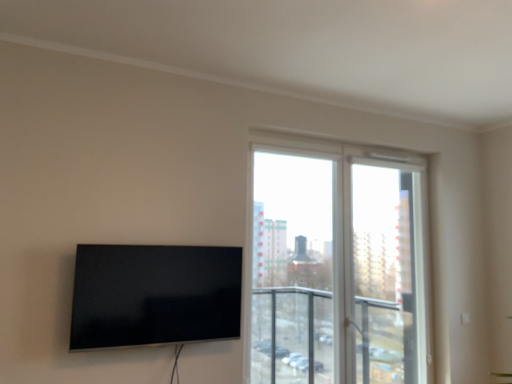
The width and height of the screenshot is (512, 384). In order to click on transparent glass window at center in this screenshot , I will do `click(336, 265)`.

Which is closer, (399, 255) or (172, 275)?

Point (399, 255) is farther from the camera than point (172, 275).

From the image's perspective, is transparent glass window at center positioned above or below matte black tv at left?

From the image's perspective, transparent glass window at center appears below matte black tv at left.

Is the depth of transparent glass window at center greater than that of matte black tv at left?

Yes, transparent glass window at center is further from the camera.

Is transparent glass window at center oriented towards matte black tv at left?

No, transparent glass window at center is not turned towards matte black tv at left.

Is transparent glass screen door at upper right wider or thinner than matte black tv at left?

Considering their sizes, transparent glass screen door at upper right looks broader than matte black tv at left.

Is transparent glass screen door at upper right to the right of matte black tv at left from the viewer's perspective?

Yes, transparent glass screen door at upper right is to the right of matte black tv at left.

How distant is transparent glass screen door at upper right from matte black tv at left?

A distance of 1.51 meters exists between transparent glass screen door at upper right and matte black tv at left.

How many degrees apart are the facing directions of transparent glass screen door at upper right and matte black tv at left?

transparent glass screen door at upper right and matte black tv at left are facing 1.27 degrees away from each other.

Where is `television above the transparent glass screen door at upper right (from the image's perspective)`? television above the transparent glass screen door at upper right (from the image's perspective) is located at coordinates (154, 295).

Is matte black tv at left positioned with its back to transparent glass screen door at upper right?

No.

Between matte black tv at left and transparent glass screen door at upper right, which one has smaller width?

With smaller width is matte black tv at left.

From a real-world perspective, which is physically above, matte black tv at left or transparent glass window at center?

From a 3D spatial view, transparent glass window at center is above.

Which of these two, matte black tv at left or transparent glass window at center, is wider?

transparent glass window at center.

Does matte black tv at left have a greater height compared to transparent glass window at center?

No.

From the image's perspective, would you say transparent glass screen door at upper right is positioned over transparent glass window at center?

No.

Considering the sizes of transparent glass screen door at upper right and transparent glass window at center in the image, is transparent glass screen door at upper right taller or shorter than transparent glass window at center?

Clearly, transparent glass screen door at upper right is shorter compared to transparent glass window at center.

Based on the photo, is transparent glass window at center inside transparent glass screen door at upper right?

No.

Is transparent glass screen door at upper right bigger than transparent glass window at center?

Incorrect, transparent glass screen door at upper right is not larger than transparent glass window at center.

Is transparent glass window at center far away from transparent glass screen door at upper right?

Yes.

Who is taller, transparent glass window at center or transparent glass screen door at upper right?

Standing taller between the two is transparent glass window at center.

Considering the relative sizes of transparent glass window at center and transparent glass screen door at upper right in the image provided, is transparent glass window at center thinner than transparent glass screen door at upper right?

No, transparent glass window at center is not thinner than transparent glass screen door at upper right.

From the image's perspective, is transparent glass window at center above or below transparent glass screen door at upper right?

transparent glass window at center is situated higher than transparent glass screen door at upper right in the image.

Locate an element on the screen. television below the transparent glass window at center (from a real-world perspective) is located at coordinates (154, 295).

Where is `screen door lying behind the matte black tv at left`? screen door lying behind the matte black tv at left is located at coordinates (388, 275).

When comparing their distances from transparent glass screen door at upper right, does transparent glass window at center or matte black tv at left seem further?

matte black tv at left is further to transparent glass screen door at upper right.

When comparing their distances from transparent glass window at center, does transparent glass screen door at upper right or matte black tv at left seem further?

matte black tv at left is further to transparent glass window at center.

Which object lies nearer to the anchor point matte black tv at left, transparent glass screen door at upper right or transparent glass window at center?

transparent glass screen door at upper right is positioned closer to the anchor matte black tv at left.

Which object lies nearer to the anchor point transparent glass window at center, matte black tv at left or transparent glass screen door at upper right?

Among the two, transparent glass screen door at upper right is located nearer to transparent glass window at center.

Based on the photo, estimate the real-world distances between objects in this image. Which object is further from transparent glass screen door at upper right, matte black tv at left or transparent glass window at center?

Among the two, matte black tv at left is located further to transparent glass screen door at upper right.

Considering their positions, is transparent glass window at center positioned further to matte black tv at left than transparent glass screen door at upper right?

Based on the image, transparent glass window at center appears to be further to matte black tv at left.

Locate an element on the screen. Image resolution: width=512 pixels, height=384 pixels. window situated between matte black tv at left and transparent glass screen door at upper right from left to right is located at coordinates [336, 265].